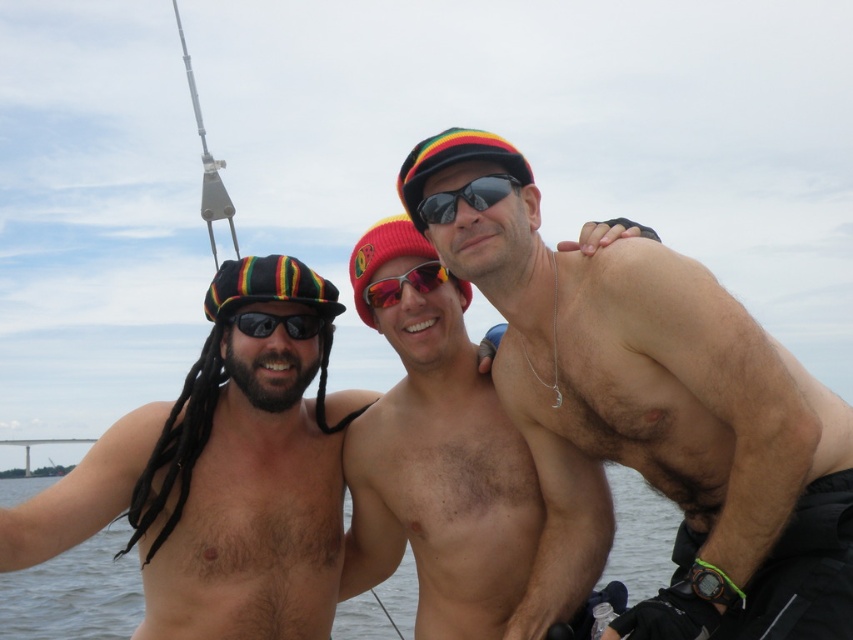
Question: Which of the following is the closest to the observer?

Choices:
 (A) shiny silver necklace at upper center
 (B) red knit beanie at center
 (C) black matte sunglasses at left

Answer: (A)

Question: Where is rasta-colored fabric cap at center located in relation to red knit beanie at center in the image?

Choices:
 (A) above
 (B) below

Answer: (A)

Question: Does shiny silver necklace at upper center have a larger size compared to reflective plastic sunglasses at center?

Choices:
 (A) yes
 (B) no

Answer: (A)

Question: Which point is closer to the camera?

Choices:
 (A) (289, 324)
 (B) (426, 176)
 (C) (265, 266)

Answer: (B)

Question: Where is red knit beanie at center located in relation to reflective plastic sunglasses at center in the image?

Choices:
 (A) right
 (B) left

Answer: (A)

Question: Among these objects, which one is farthest from the camera?

Choices:
 (A) reflective plastic sunglasses at center
 (B) black matte sunglasses at left
 (C) shiny metallic diver at center

Answer: (A)